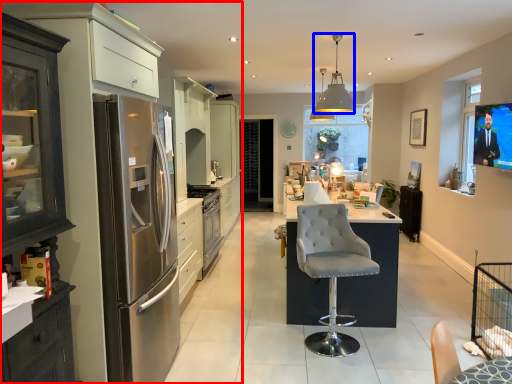
Question: Which point is closer to the camera, entertainment center (highlighted by a red box) or light fixture (highlighted by a blue box)?

Choices:
 (A) entertainment center
 (B) light fixture

Answer: (A)